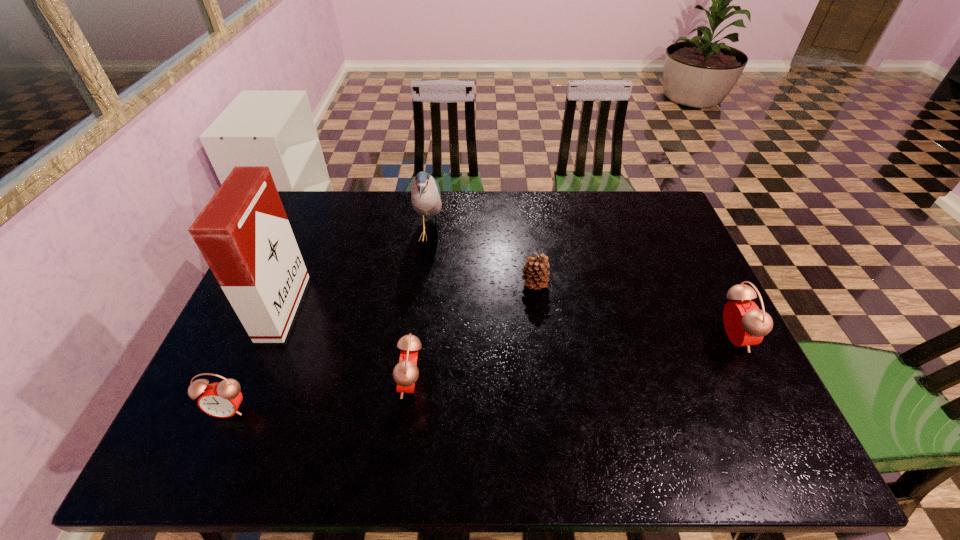
The height and width of the screenshot is (540, 960). In order to click on vacant space that satisfies the following two spatial constraints: 1. on the front side of the pinecone; 2. on the clock face of the second tallest alarm clock in this screenshot , I will do `click(546, 383)`.

You are a GUI agent. You are given a task and a screenshot of the screen. Output one action in this format:
    pyautogui.click(x=<x>, y=<y>)
    Task: Click on the vacant space that satisfies the following two spatial constraints: 1. on the clock face of the rightmost alarm clock; 2. on the clock face of the leftmost alarm clock
    The height and width of the screenshot is (540, 960).
    Given the screenshot: What is the action you would take?
    pyautogui.click(x=768, y=409)

At what (x,y) coordinates should I click in order to perform the action: click on vacant area that satisfies the following two spatial constraints: 1. at the tip of the pinecone's beak; 2. on the left side of the second tallest object. Please return your answer as a coordinate pair (x, y). Looking at the image, I should click on (423, 285).